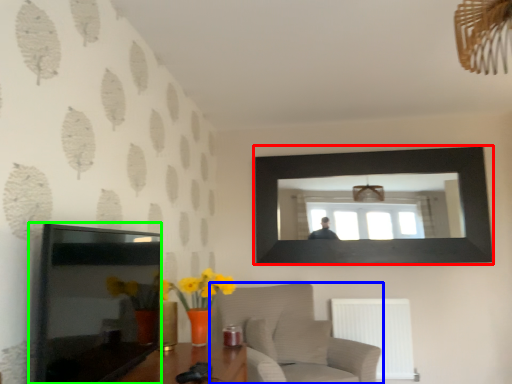
Question: Estimate the real-world distances between objects in this image. Which object is closer to picture frame (highlighted by a red box), furniture (highlighted by a blue box) or picture frame (highlighted by a green box)?

Choices:
 (A) furniture
 (B) picture frame

Answer: (A)